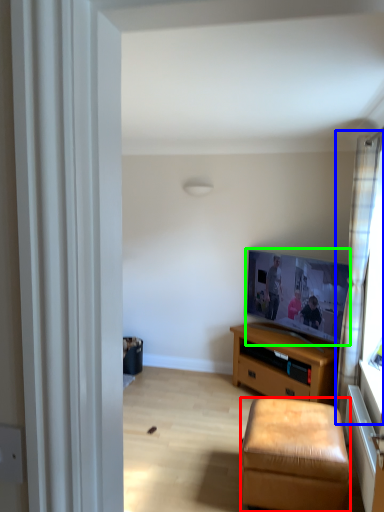
Question: Which object is the farthest from stool (highlighted by a red box)? Choose among these: curtain (highlighted by a blue box) or picture frame (highlighted by a green box).

Choices:
 (A) curtain
 (B) picture frame

Answer: (B)